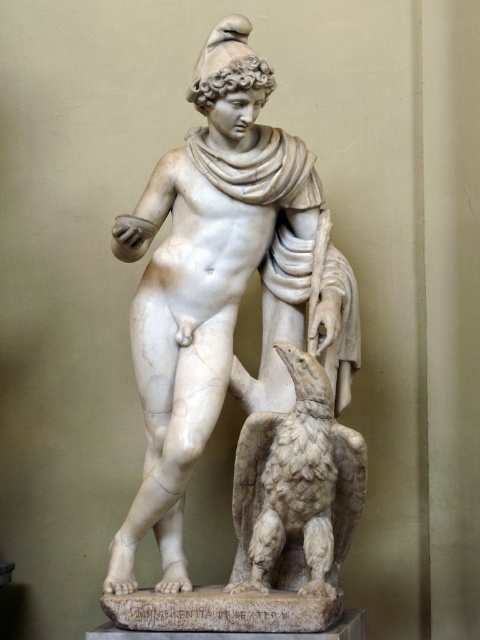
Between point (266, 232) and point (300, 554), which one is positioned behind?

Positioned behind is point (266, 232).

Does white marble statue at center have a larger size compared to white marble bird at lower center?

Yes, white marble statue at center is bigger than white marble bird at lower center.

Who is more forward, (172, 204) or (314, 371)?

Positioned in front is point (314, 371).

The width and height of the screenshot is (480, 640). Find the location of `white marble statue at center`. white marble statue at center is located at coordinates (212, 284).